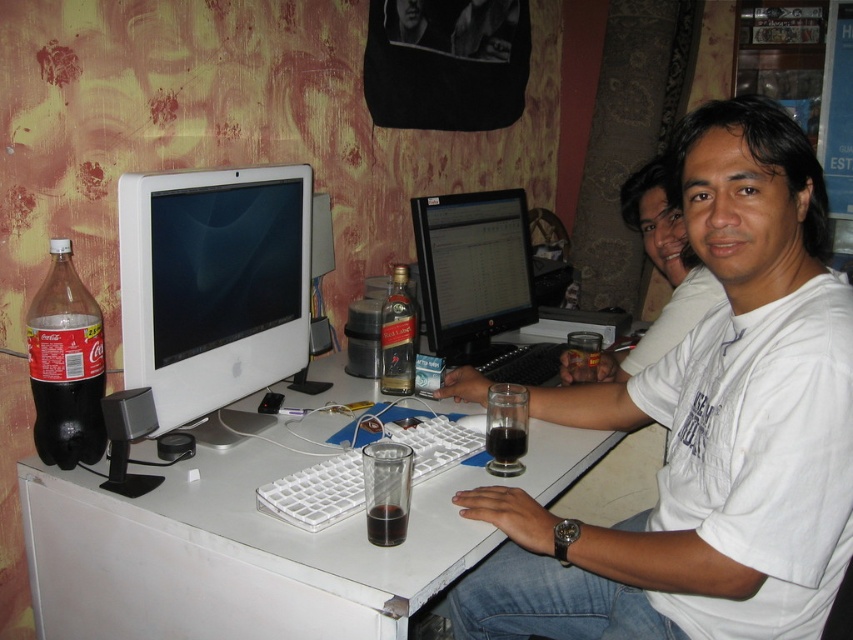
You are a delivery person who needs to place a small package on the desk. The package must be placed at a point that is closer to the viewer than the other objects on the desk. Which of the two points, point (711, 380) or point (517, 451), should you choose?

You should choose point (711, 380) because it is closer to the viewer than point (517, 451) according to the description.

You have a desk with a white glossy computer monitor at center and a white plastic keyboard at center. Which object is wider?

The white plastic keyboard at center is wider than the white glossy computer monitor at center.